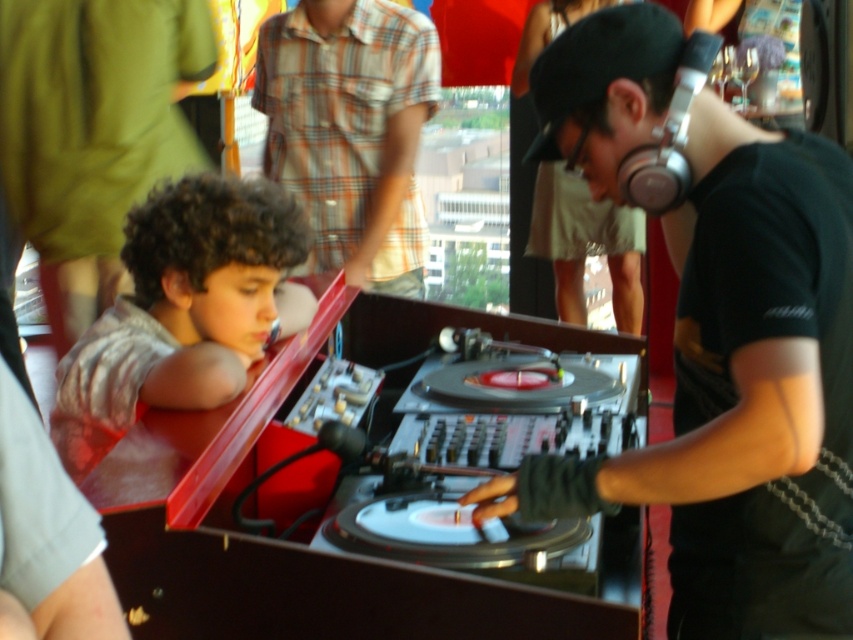
Is curly-haired boy at left bigger than plaid shirt at upper center?

No.

Which is in front, point (143, 214) or point (378, 28)?

Point (143, 214) is in front.

Locate an element on the screen. curly-haired boy at left is located at coordinates (184, 308).

Is point (567, 51) farther from viewer compared to point (283, 106)?

No.

Is black matte headphones at center bigger than plaid shirt at upper center?

No, black matte headphones at center is not bigger than plaid shirt at upper center.

Identify the location of black matte headphones at center. (741, 392).

Does black matte headphones at center appear under curly-haired boy at left?

Actually, black matte headphones at center is above curly-haired boy at left.

You are a GUI agent. You are given a task and a screenshot of the screen. Output one action in this format:
    pyautogui.click(x=<x>, y=<y>)
    Task: Click on the black matte headphones at center
    
    Given the screenshot: What is the action you would take?
    click(741, 392)

Who is more forward, (x=749, y=433) or (x=125, y=344)?

Positioned in front is point (x=749, y=433).

At what (x,y) coordinates should I click in order to perform the action: click on black matte headphones at center. Please return your answer as a coordinate pair (x, y). The image size is (853, 640). Looking at the image, I should click on tap(741, 392).